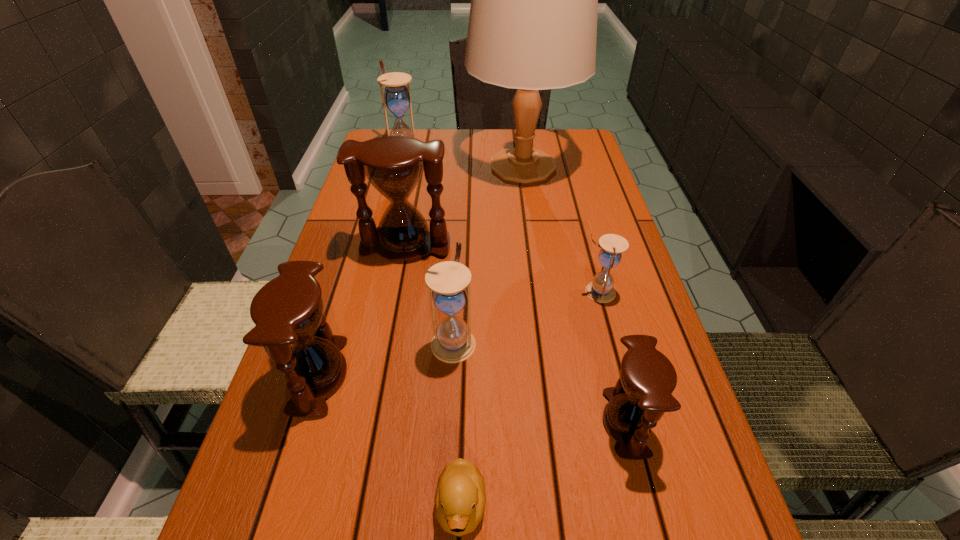
You are a GUI agent. You are given a task and a screenshot of the screen. Output one action in this format:
    pyautogui.click(x=<x>, y=<y>)
    Task: Click on the second farthest white hourglass
    
    Given the screenshot: What is the action you would take?
    pyautogui.click(x=601, y=290)

The width and height of the screenshot is (960, 540). What are the coordinates of `the rightmost brown hourglass` in the screenshot? It's located at (643, 393).

Where is `free location located 0.190m on the left of the beige table lamp`? free location located 0.190m on the left of the beige table lamp is located at coordinates (406, 166).

Image resolution: width=960 pixels, height=540 pixels. What are the coordinates of `free space located on the right of the leftmost white hourglass` in the screenshot? It's located at (513, 151).

Find the location of a particular element. vacant area situated 0.060m on the left of the biggest brown hourglass is located at coordinates click(x=337, y=246).

The height and width of the screenshot is (540, 960). I want to click on vacant area situated on the back of the second biggest brown hourglass, so click(x=365, y=226).

Locate an element on the screen. The height and width of the screenshot is (540, 960). blank space located on the back of the second smallest white hourglass is located at coordinates pos(456,294).

The height and width of the screenshot is (540, 960). I want to click on vacant space situated 0.270m on the back of the smallest white hourglass, so click(576, 212).

Find the location of a particular element. The width and height of the screenshot is (960, 540). blank space located on the back of the rightmost brown hourglass is located at coordinates (612, 366).

Where is `table lamp positioned at the far edge`? table lamp positioned at the far edge is located at coordinates (534, 0).